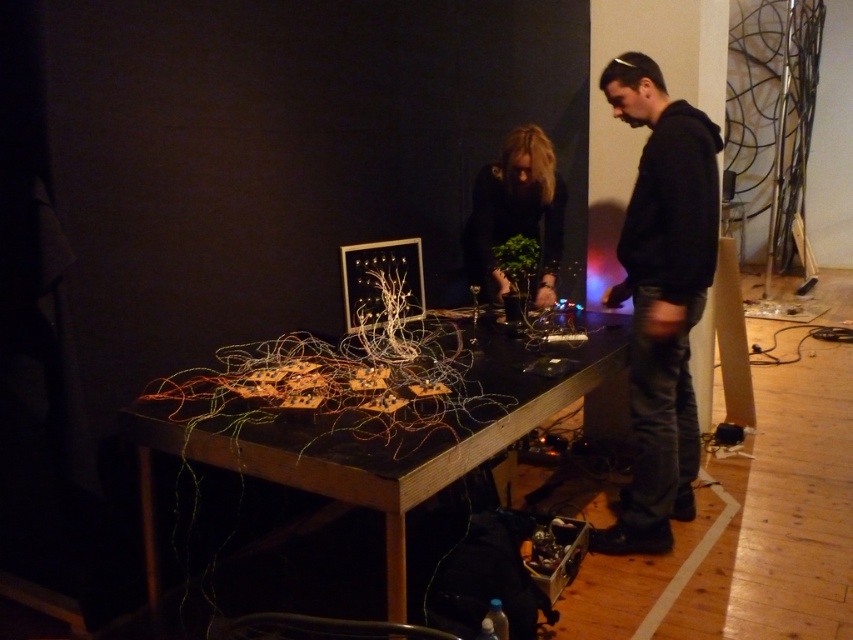
Who is lower down, black hoodie at right or black matte plant at center?

black hoodie at right

What do you see at coordinates (660, 298) in the screenshot? I see `black hoodie at right` at bounding box center [660, 298].

Image resolution: width=853 pixels, height=640 pixels. I want to click on black hoodie at right, so click(x=660, y=298).

Can you confirm if wooden table at center is positioned to the left of black matte plant at center?

Indeed, wooden table at center is positioned on the left side of black matte plant at center.

Does point (398, 513) come closer to viewer compared to point (549, 253)?

Yes, point (398, 513) is in front of point (549, 253).

Between point (519, 358) and point (534, 189), which one is positioned in front?

Positioned in front is point (519, 358).

Image resolution: width=853 pixels, height=640 pixels. I want to click on wooden table at center, so click(374, 436).

Describe the element at coordinates (374, 436) in the screenshot. I see `wooden table at center` at that location.

Can you confirm if wooden table at center is bigger than black hoodie at right?

Indeed, wooden table at center has a larger size compared to black hoodie at right.

Does point (422, 426) lie behind point (654, 131)?

No.

This screenshot has width=853, height=640. I want to click on wooden table at center, so click(374, 436).